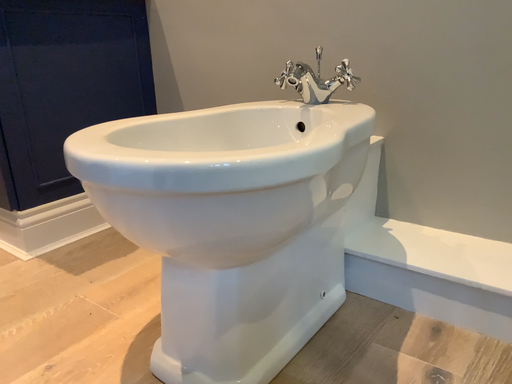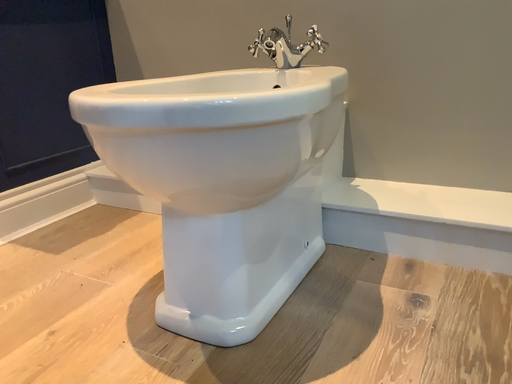
Question: Which way did the camera rotate in the video?

Choices:
 (A) rotated left
 (B) rotated right

Answer: (B)